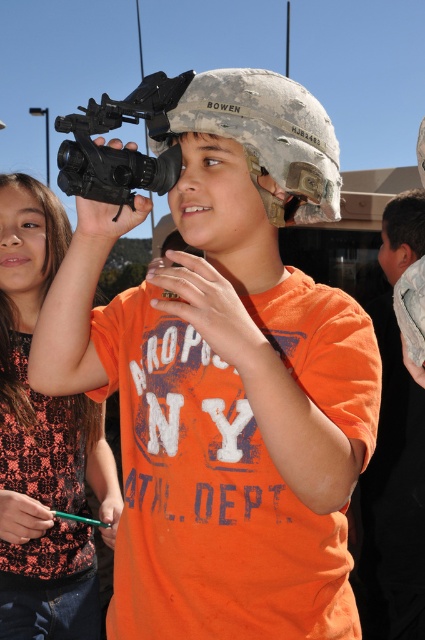
You are a photographer trying to capture a clear image of the black matte gun at center. However, the orange lace shirt at upper left is blocking your view. Can you move the shirt to get a better shot?

Result: The black matte gun at center is behind the orange lace shirt at upper left, so moving the orange lace shirt at upper left would allow you to see the black matte gun at center clearly.

You are a photographer trying to capture the boy holding the black matte gun at center while ensuring the orange lace shirt at upper left is visible in the frame. Based on their positions, can you position yourself so that both objects are in the same photo?

The orange lace shirt at upper left is below the black matte gun at center, so if you position yourself to include both the lower and upper parts of the scene, both objects will be visible in the photo.

You are a photographer trying to capture the boy holding the video camera. You notice two points in the scene at coordinates point (54, 268) and point (70, 154). Which point is closer to your camera lens?

Point (54, 268) is further to the viewer than point (70, 154), so the point closer to your camera lens is point (70, 154).